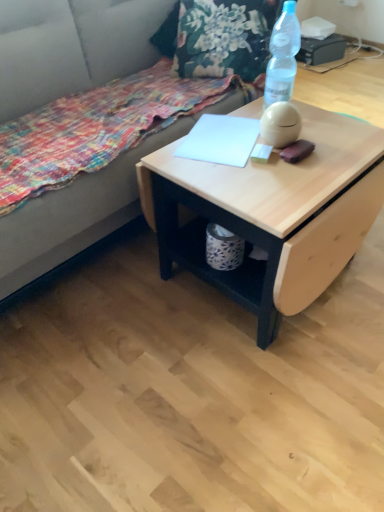
Identify the location of free space above natural wood desk at center (from a real-world perspective). This screenshot has width=384, height=512. (268, 153).